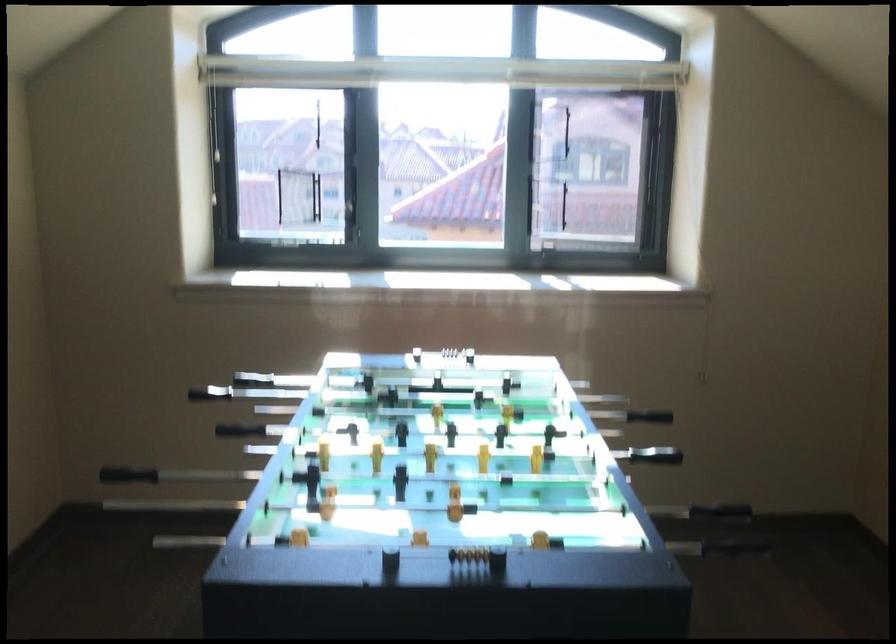
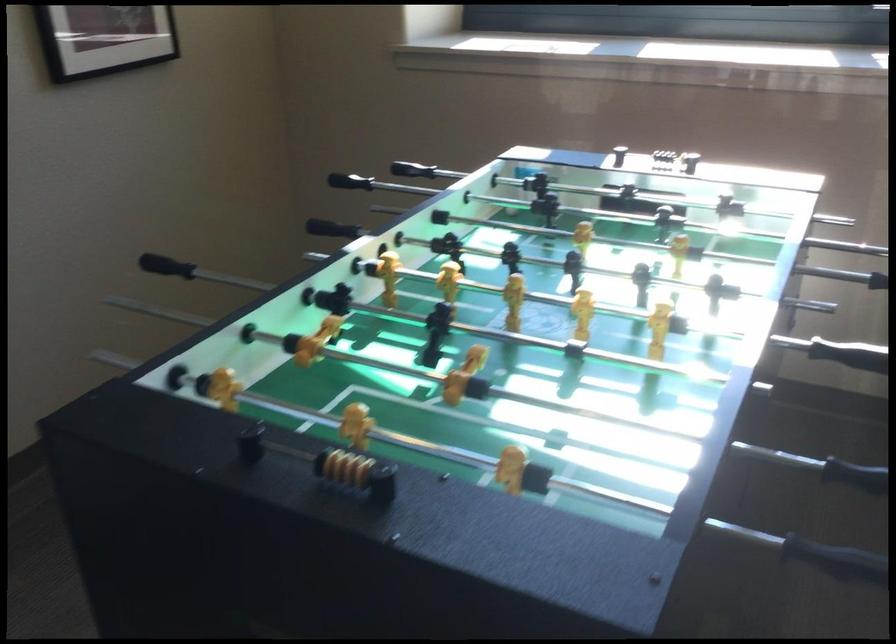
Looking at this image, first-person continuous shooting, in which direction is the camera rotating?

The camera rotated toward left-down.